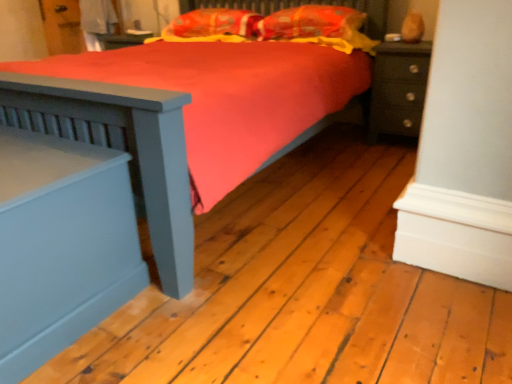
Question: Is matte blue nightstand at left, which is counted as the first nightstand, starting from the bottom, surrounded by matte dark green nightstand at right, which is the second nightstand in front-to-back order?

Choices:
 (A) yes
 (B) no

Answer: (B)

Question: Can you confirm if matte dark green nightstand at right, the 1th nightstand from the back, is positioned to the right of matte blue nightstand at left, which ranks as the second nightstand in back-to-front order?

Choices:
 (A) no
 (B) yes

Answer: (B)

Question: Is matte dark green nightstand at right, which is the second nightstand from left to right, positioned in front of matte blue nightstand at left, acting as the 2th nightstand starting from the right?

Choices:
 (A) yes
 (B) no

Answer: (B)

Question: Is matte dark green nightstand at right, the second nightstand ordered from the bottom, directly adjacent to matte blue nightstand at left, acting as the 2th nightstand starting from the right?

Choices:
 (A) yes
 (B) no

Answer: (B)

Question: Can you confirm if matte dark green nightstand at right, the second nightstand ordered from the bottom, is shorter than matte blue nightstand at left, which is counted as the first nightstand, starting from the left?

Choices:
 (A) no
 (B) yes

Answer: (A)

Question: Considering the relative sizes of matte dark green nightstand at right, which is the second nightstand in front-to-back order, and matte blue nightstand at left, the first nightstand when ordered from front to back, in the image provided, is matte dark green nightstand at right, which is the second nightstand in front-to-back order, taller than matte blue nightstand at left, the first nightstand when ordered from front to back,?

Choices:
 (A) no
 (B) yes

Answer: (B)

Question: Does orange fabric pillow at upper center, which appears as the 2th pillow when viewed from the right, lie in front of matte blue nightstand at left, which ranks as the second nightstand in back-to-front order?

Choices:
 (A) no
 (B) yes

Answer: (A)

Question: From the image's perspective, is orange fabric pillow at upper center, the 1th pillow in the left-to-right sequence, under matte blue nightstand at left, which is counted as the first nightstand, starting from the left?

Choices:
 (A) no
 (B) yes

Answer: (A)

Question: Is orange fabric pillow at upper center, the 1th pillow in the left-to-right sequence, looking in the opposite direction of matte blue nightstand at left, the 2th nightstand when ordered from top to bottom?

Choices:
 (A) no
 (B) yes

Answer: (A)

Question: Is orange fabric pillow at upper center, which appears as the 2th pillow when viewed from the right, to the left of matte blue nightstand at left, which ranks as the second nightstand in back-to-front order, from the viewer's perspective?

Choices:
 (A) no
 (B) yes

Answer: (A)

Question: Can you confirm if orange fabric pillow at upper center, which appears as the 2th pillow when viewed from the right, is shorter than matte blue nightstand at left, acting as the 2th nightstand starting from the right?

Choices:
 (A) yes
 (B) no

Answer: (A)

Question: Is orange fabric pillow at upper center, the 1th pillow in the left-to-right sequence, surrounding matte blue nightstand at left, which is counted as the first nightstand, starting from the bottom?

Choices:
 (A) yes
 (B) no

Answer: (B)

Question: Is matte blue nightstand at left, the 2th nightstand when ordered from top to bottom, in contact with orange fabric pillow at upper center, which appears as the 2th pillow when viewed from the right?

Choices:
 (A) no
 (B) yes

Answer: (A)